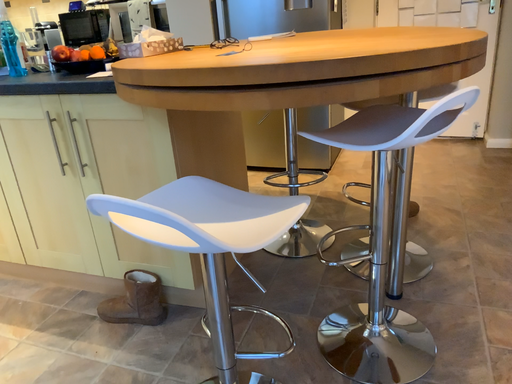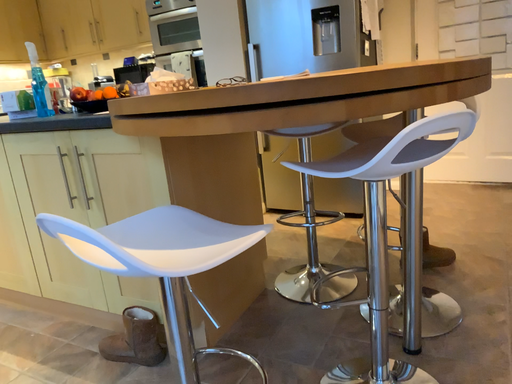
Question: Which way did the camera rotate in the video?

Choices:
 (A) rotated downward
 (B) rotated upward

Answer: (B)